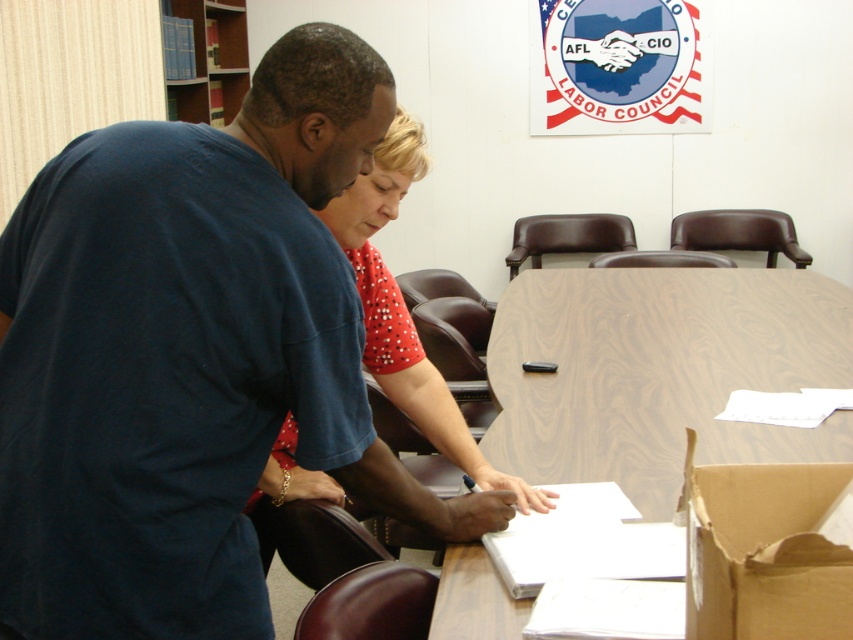
Between wooden table at center and brown cardboard box at lower right, which one is positioned higher?

wooden table at center is above.

Image resolution: width=853 pixels, height=640 pixels. I want to click on wooden table at center, so click(x=660, y=371).

Is dark blue shirt at upper left positioned at the back of brown cardboard box at lower right?

Yes, dark blue shirt at upper left is further from the viewer.

Between point (91, 412) and point (776, 554), which one is positioned behind?

The point (91, 412) is behind.

Which is behind, point (399, 515) or point (817, 632)?

Point (399, 515)

The width and height of the screenshot is (853, 640). I want to click on dark blue shirt at upper left, so click(178, 349).

Is wooden table at center shorter than red dotted blouse at center?

Indeed, wooden table at center has a lesser height compared to red dotted blouse at center.

Which of these two, wooden table at center or red dotted blouse at center, stands shorter?

wooden table at center is shorter.

This screenshot has width=853, height=640. In order to click on wooden table at center in this screenshot , I will do click(660, 371).

What are the coordinates of `wooden table at center` in the screenshot? It's located at pyautogui.click(x=660, y=371).